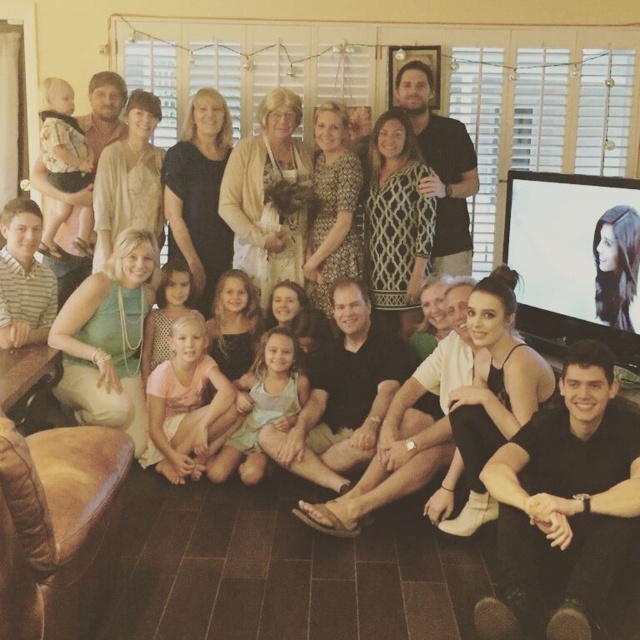
Question: Can you confirm if pink cotton shirt at center is positioned below light blue fabric dress at center?

Choices:
 (A) yes
 (B) no

Answer: (B)

Question: Is light blue fabric dress at center above light pink fabric dress at center?

Choices:
 (A) yes
 (B) no

Answer: (B)

Question: Does pink cotton shirt at center have a smaller size compared to light pink fabric dress at center?

Choices:
 (A) yes
 (B) no

Answer: (B)

Question: Which of the following is the closest to the observer?

Choices:
 (A) (189, 385)
 (B) (86, 221)

Answer: (A)

Question: Which point is farther from the camera taking this photo?

Choices:
 (A) (70, 177)
 (B) (196, 316)
 (C) (289, 408)

Answer: (A)

Question: Which object is the farthest from the light brown fabric baby carrier at left?

Choices:
 (A) light blue fabric dress at center
 (B) light pink fabric dress at center

Answer: (A)